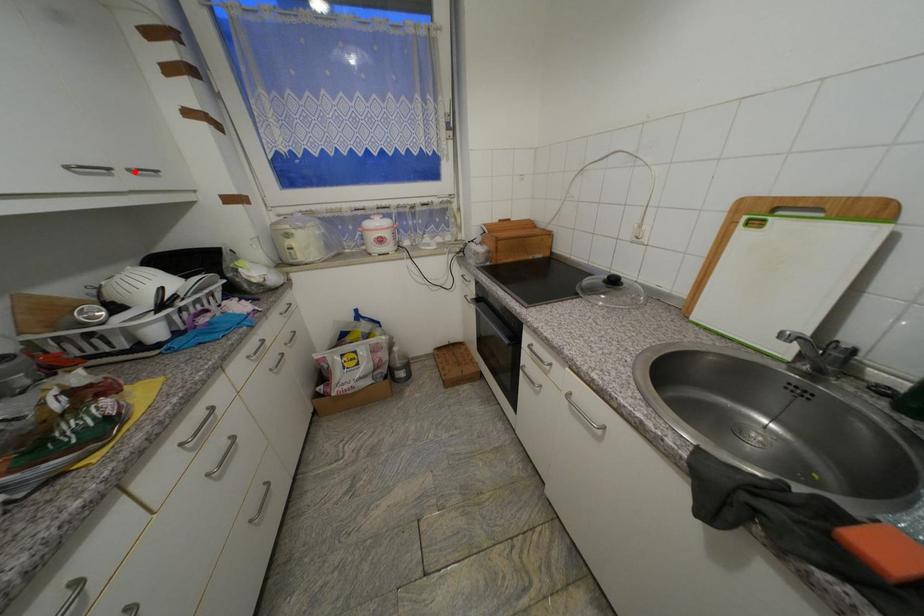
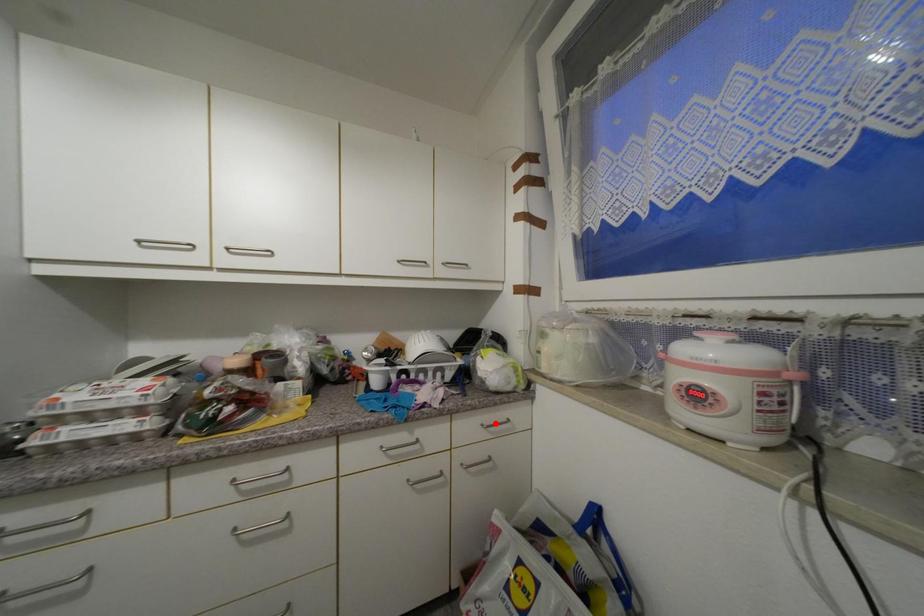
I am providing you with two images of the same scene from different viewpoints. A red point is marked on the first image and another point is marked on the second image. Does the point marked in image1 correspond to the same location as the one in image2?

No